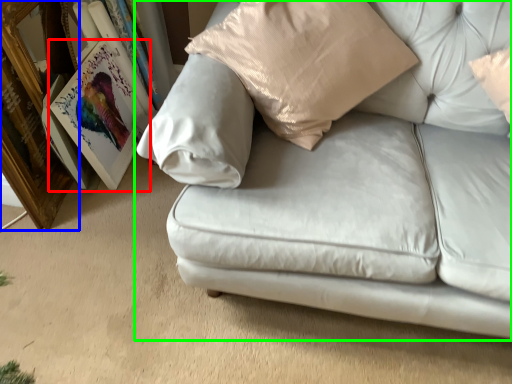
Question: Considering the real-world distances, which object is closest to picture frame (highlighted by a red box)? picture frame (highlighted by a blue box) or studio couch (highlighted by a green box).

Choices:
 (A) picture frame
 (B) studio couch

Answer: (A)